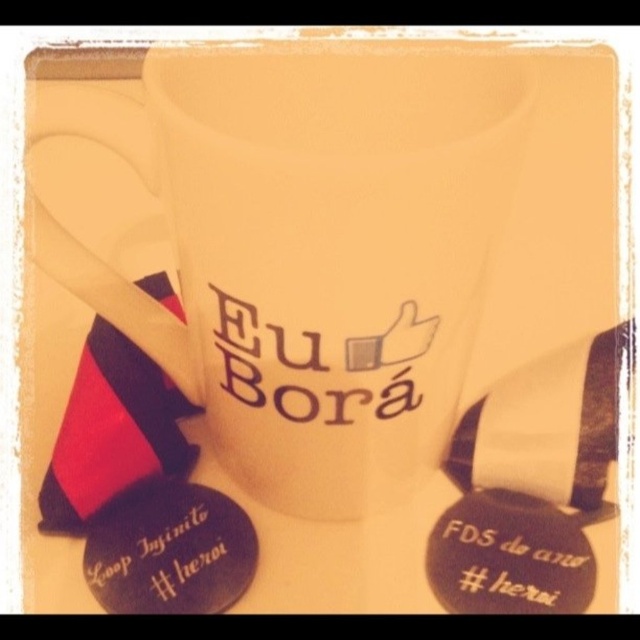
You are holding a camera and want to take a photo of the white matte mug at center. If your camera requires the subject to be at least 24 inches away to focus properly, will you need to move closer or farther away to get a clear shot?

The white matte mug at center is currently 23.40 inches away from the camera, which is less than the required 24 inches. To get a clear shot, you need to move farther away from the mug to increase the distance to at least 24 inches.

You are organizing a badge display and need to know the width of the black matte badge at lower left and the black matte badge at lower right. Based on the image, which badge is wider?

The black matte badge at lower left might be wider than black matte badge at lower right according to the description.

You are a delivery person who needs to place a package on the table where the white matte mug at center and the black matte badge at lower right are located. The package is 15 inches wide. Will it fit between the two items without overlapping them?

The distance between the white matte mug at center and the black matte badge at lower right is 14.59 inches. Since the package is 15 inches wide, it will not fit between them without overlapping because the package is wider than the available space.